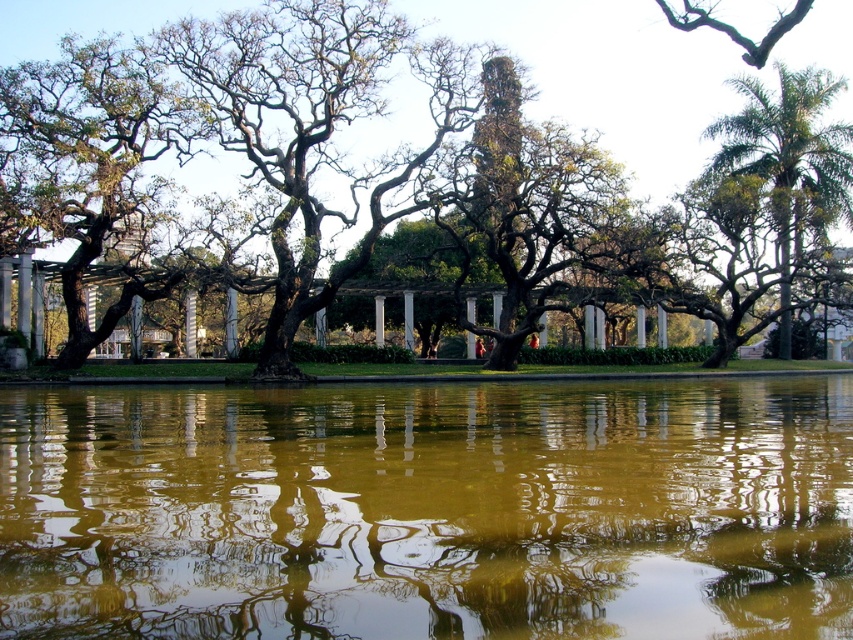
You are standing in the park and want to take a photo of the green leafy palm at right without the green reflective water at center appearing in the foreground. Is this possible?

The green reflective water at center is in front of the green leafy palm at right, so it will block the view of the palm. Therefore, it is not possible to take a photo of the green leafy palm at right without the green reflective water at center appearing in the foreground.

You are standing in the park and want to take a photo of both the green reflective water at center and the green leafy tree at center. Which object should you adjust your camera to focus on first if you want the tree to appear larger in the photo?

To make the green leafy tree at center appear larger in the photo, you should focus on the green leafy tree at center first since it is positioned to the right of the green reflective water at center, making it closer to the camera.

You are standing at the edge of the pond in the park scene. There is a point marked at coordinates (x=428, y=509). Based on the scene description, where would this point most likely be located?

The point is on the green reflective water at center.